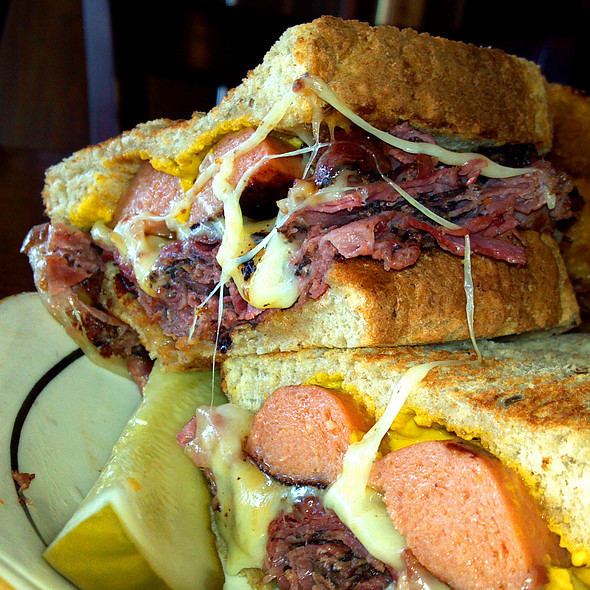
At what (x,y) coordinates should I click in order to perform the action: click on white plate or bowl. Please return your answer as a coordinate pair (x, y). The image size is (590, 590). Looking at the image, I should click on (29, 372).